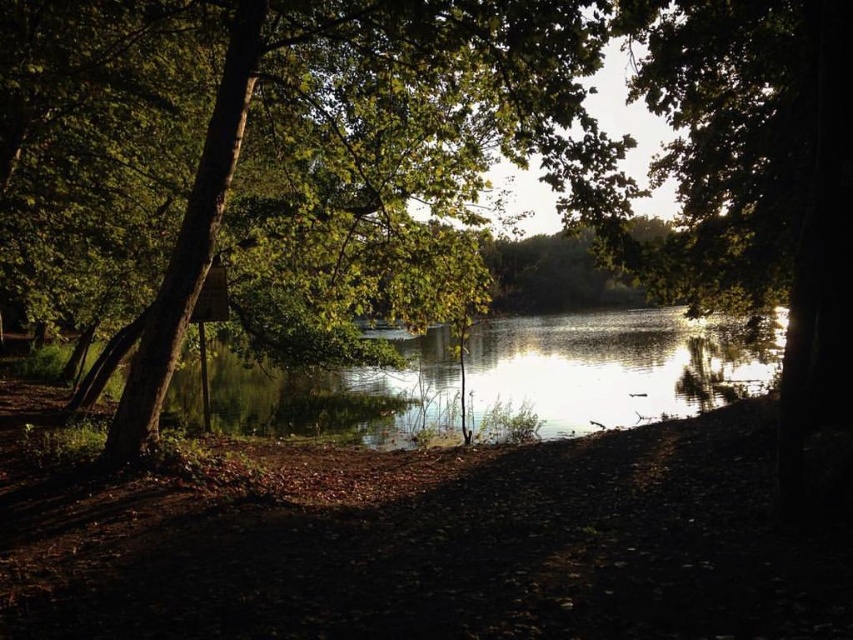
Question: Can you confirm if green leafy tree at center is positioned to the left of glistening water at center?

Choices:
 (A) yes
 (B) no

Answer: (A)

Question: Does green leafy tree at center lie behind glistening water at center?

Choices:
 (A) no
 (B) yes

Answer: (A)

Question: Which of the following is the farthest from the observer?

Choices:
 (A) (410, 397)
 (B) (234, 164)

Answer: (A)

Question: Can you confirm if green leafy tree at center is thinner than glistening water at center?

Choices:
 (A) no
 (B) yes

Answer: (B)